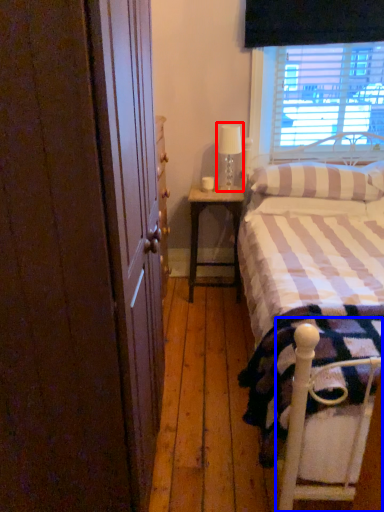
Question: Which of the following is the closest to the observer, table lamp (highlighted by a red box) or bed frame (highlighted by a blue box)?

Choices:
 (A) table lamp
 (B) bed frame

Answer: (B)